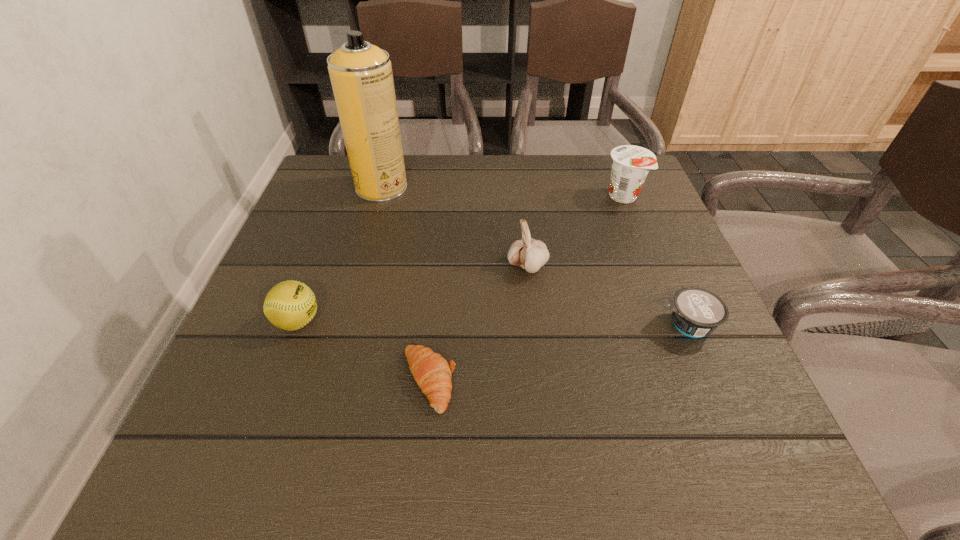
Locate an element on the screen. This screenshot has width=960, height=540. object present at the far right corner is located at coordinates (630, 164).

You are a GUI agent. You are given a task and a screenshot of the screen. Output one action in this format:
    pyautogui.click(x=<x>, y=<y>)
    Task: Click on the vacant region at the far edge of the desktop
    The image size is (960, 540).
    Given the screenshot: What is the action you would take?
    pyautogui.click(x=576, y=159)

Find the location of a particular element. The width and height of the screenshot is (960, 540). vacant space at the near edge is located at coordinates [532, 442].

Identify the location of free space at the left edge of the desktop. (324, 334).

The width and height of the screenshot is (960, 540). Find the location of `vacant space at the right edge`. vacant space at the right edge is located at coordinates (659, 251).

This screenshot has width=960, height=540. What are the coordinates of `vacant area at the far right corner` in the screenshot? It's located at (592, 199).

This screenshot has width=960, height=540. What are the coordinates of `empty space that is in between the fourth object from right to left and the nearer yogurt` in the screenshot? It's located at (558, 353).

The height and width of the screenshot is (540, 960). Find the location of `free spot between the nearer yogurt and the garlic`. free spot between the nearer yogurt and the garlic is located at coordinates (607, 295).

Find the location of a particular element. free space between the tallest object and the fourth object from left to right is located at coordinates (454, 227).

This screenshot has height=540, width=960. What are the coordinates of `empty space that is in between the softball and the second shortest object` in the screenshot? It's located at (492, 323).